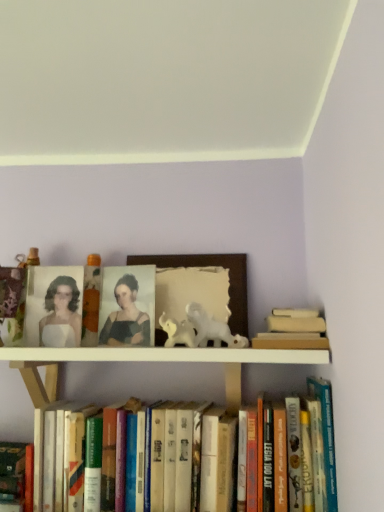
Measure the distance between hardcover book at lower left, which is the first book from left to right, and camera.

32.80 inches.

In order to click on beige cardboard book at upper right, acting as the first book starting from the right in this screenshot , I will do `click(293, 330)`.

The image size is (384, 512). What are the coordinates of `matte orange candle at upper center` in the screenshot? It's located at (91, 301).

Describe the element at coordinates (127, 306) in the screenshot. Image resolution: width=384 pixels, height=512 pixels. I see `matte black portrait at center` at that location.

Describe the element at coordinates (217, 265) in the screenshot. I see `wooden picture frame at center` at that location.

This screenshot has width=384, height=512. What do you see at coordinates (178, 332) in the screenshot?
I see `white glossy horse at center` at bounding box center [178, 332].

Image resolution: width=384 pixels, height=512 pixels. What do you see at coordinates (303, 450) in the screenshot?
I see `hardcover books at lower center, the 2th book positioned from the left` at bounding box center [303, 450].

Locate an element on the screen. hardcover book at lower left, the third book when ordered from right to left is located at coordinates (17, 473).

Who is smaller, beige cardboard book at upper right, placed as the third book when sorted from left to right, or white glossy horse at center?

white glossy horse at center is smaller.

Is beige cardboard book at upper right, acting as the first book starting from the right, completely or partially outside of white glossy horse at center?

Yes, beige cardboard book at upper right, acting as the first book starting from the right, is located beyond the bounds of white glossy horse at center.

How different are the orientations of beige cardboard book at upper right, acting as the first book starting from the right, and white glossy horse at center in degrees?

0.935 degrees separate the facing orientations of beige cardboard book at upper right, acting as the first book starting from the right, and white glossy horse at center.

From the image's perspective, which one is positioned higher, beige cardboard book at upper right, placed as the third book when sorted from left to right, or white glossy horse at center?

white glossy horse at center.

Starting from the matte black portrait at center, which book is the 1st one in front? Please provide its 2D coordinates.

[(17, 473)]

From a real-world perspective, is hardcover book at lower left, the third book when ordered from right to left, beneath matte black portrait at center?

Yes, from a real-world perspective, hardcover book at lower left, the third book when ordered from right to left, is under matte black portrait at center.

Who is smaller, hardcover book at lower left, which is the first book from left to right, or matte black portrait at center?

matte black portrait at center is smaller.

Is matte black portrait at center facing away from hardcover book at lower left, which is the first book from left to right?

No, matte black portrait at center's orientation is not away from hardcover book at lower left, which is the first book from left to right.

From the picture: From a real-world perspective, relative to hardcover book at lower left, which is the first book from left to right, is matte black portrait at center vertically above or below?

matte black portrait at center is situated higher than hardcover book at lower left, which is the first book from left to right, in the real world.

Between matte black portrait at center and hardcover book at lower left, which is the first book from left to right, which one has less height?

Standing shorter between the two is hardcover book at lower left, which is the first book from left to right.

Locate an element on the screen. This screenshot has height=512, width=384. person on the right side of hardcover book at lower left, which is the first book from left to right is located at coordinates (127, 306).

Does matte orange candle at upper center turn towards white glossy horse at center?

No.

Which is closer, (88,294) or (188,343)?

The point (188,343) is in front.

Looking at this image, which is in front, matte orange candle at upper center or white glossy horse at center?

white glossy horse at center is in front.

Based on their sizes in the image, would you say matte orange candle at upper center is bigger or smaller than white glossy horse at center?

Clearly, matte orange candle at upper center is larger in size than white glossy horse at center.

From the image's perspective, relative to matte orange candle at upper center, is matte white portrait at upper left above or below?

matte white portrait at upper left is situated lower than matte orange candle at upper center in the image.

From a real-world perspective, is matte white portrait at upper left physically located above or below matte orange candle at upper center?

Clearly, from a real-world perspective, matte white portrait at upper left is below matte orange candle at upper center.

Is matte white portrait at upper left in contact with matte orange candle at upper center?

Yes, matte white portrait at upper left and matte orange candle at upper center clearly make contact.

Which is behind, point (64, 343) or point (86, 307)?

Positioned behind is point (86, 307).

Do you think hardcover book at lower left, the third book when ordered from right to left, is within hardcover books at lower center, which ranks as the second book in right-to-left order, or outside of it?

The correct answer is: outside.

Is point (5, 451) farther from viewer compared to point (317, 437)?

Yes, point (5, 451) is behind point (317, 437).

Can you confirm if hardcover book at lower left, the third book when ordered from right to left, is thinner than hardcover books at lower center, which ranks as the second book in right-to-left order?

Indeed, hardcover book at lower left, the third book when ordered from right to left, has a lesser width compared to hardcover books at lower center, which ranks as the second book in right-to-left order.

How many degrees apart are the facing directions of hardcover book at lower left, which is the first book from left to right, and hardcover books at lower center, which ranks as the second book in right-to-left order?

The angle between the facing direction of hardcover book at lower left, which is the first book from left to right, and the facing direction of hardcover books at lower center, which ranks as the second book in right-to-left order, is 0.00112 degrees.

Which is behind, point (171, 325) or point (93, 254)?

The point (93, 254) is more distant.

Do you think white glossy horse at center is within matte orange candle at upper center, or outside of it?

white glossy horse at center exists outside the volume of matte orange candle at upper center.

Which is more to the right, white glossy horse at center or matte orange candle at upper center?

Positioned to the right is white glossy horse at center.

Identify the location of animal that appears on the left of beige cardboard book at upper right, placed as the third book when sorted from left to right. The height and width of the screenshot is (512, 384). (178, 332).

From a real-world perspective, which book is the 3rd one underneath the matte black portrait at center? Please provide its 2D coordinates.

[(17, 473)]

Considering their positions, is white glossy horse at center positioned further to hardcover books at lower center, the 2th book positioned from the left, than wooden picture frame at center?

wooden picture frame at center is further to hardcover books at lower center, the 2th book positioned from the left.

From the image, which object appears to be nearer to matte white portrait at upper left, wooden picture frame at center or hardcover book at lower left, the third book when ordered from right to left?

The object closer to matte white portrait at upper left is hardcover book at lower left, the third book when ordered from right to left.

Looking at the image, which one is located further to hardcover book at lower left, which is the first book from left to right, wooden picture frame at center or matte white portrait at upper left?

wooden picture frame at center.

Estimate the real-world distances between objects in this image. Which object is further from wooden picture frame at center, hardcover books at lower center, which ranks as the second book in right-to-left order, or white glossy horse at center?

hardcover books at lower center, which ranks as the second book in right-to-left order, is positioned further to the anchor wooden picture frame at center.

Based on their spatial positions, is hardcover book at lower left, which is the first book from left to right, or wooden picture frame at center closer to matte orange candle at upper center?

wooden picture frame at center.

Consider the image. Considering their positions, is matte white portrait at upper left positioned further to white glossy horse at center than hardcover book at lower left, the third book when ordered from right to left?

Among the two, hardcover book at lower left, the third book when ordered from right to left, is located further to white glossy horse at center.

From the image, which object appears to be farther from matte black portrait at center, wooden picture frame at center or hardcover books at lower center, the 2th book positioned from the left?

The object further to matte black portrait at center is hardcover books at lower center, the 2th book positioned from the left.

Based on their spatial positions, is white glossy horse at center or beige cardboard book at upper right, placed as the third book when sorted from left to right, further from hardcover book at lower left, the third book when ordered from right to left?

beige cardboard book at upper right, placed as the third book when sorted from left to right, is positioned further to the anchor hardcover book at lower left, the third book when ordered from right to left.

You are a GUI agent. You are given a task and a screenshot of the screen. Output one action in this format:
    pyautogui.click(x=<x>, y=<y>)
    Task: Click on the animal between wooden picture frame at center and hardcover books at lower center, which ranks as the second book in right-to-left order, vertically
    The image size is (384, 512).
    Given the screenshot: What is the action you would take?
    pyautogui.click(x=178, y=332)

Locate an element on the screen. The width and height of the screenshot is (384, 512). toy between hardcover book at lower left, which is the first book from left to right, and wooden picture frame at center is located at coordinates (91, 301).

Locate an element on the screen. The width and height of the screenshot is (384, 512). toy located between hardcover book at lower left, the third book when ordered from right to left, and beige cardboard book at upper right, placed as the third book when sorted from left to right, in the left-right direction is located at coordinates (91, 301).

You are a GUI agent. You are given a task and a screenshot of the screen. Output one action in this format:
    pyautogui.click(x=<x>, y=<y>)
    Task: Click on the picture frame located between matte black portrait at center and beige cardboard book at upper right, placed as the third book when sorted from left to right, in the left-right direction
    
    Given the screenshot: What is the action you would take?
    pyautogui.click(x=217, y=265)